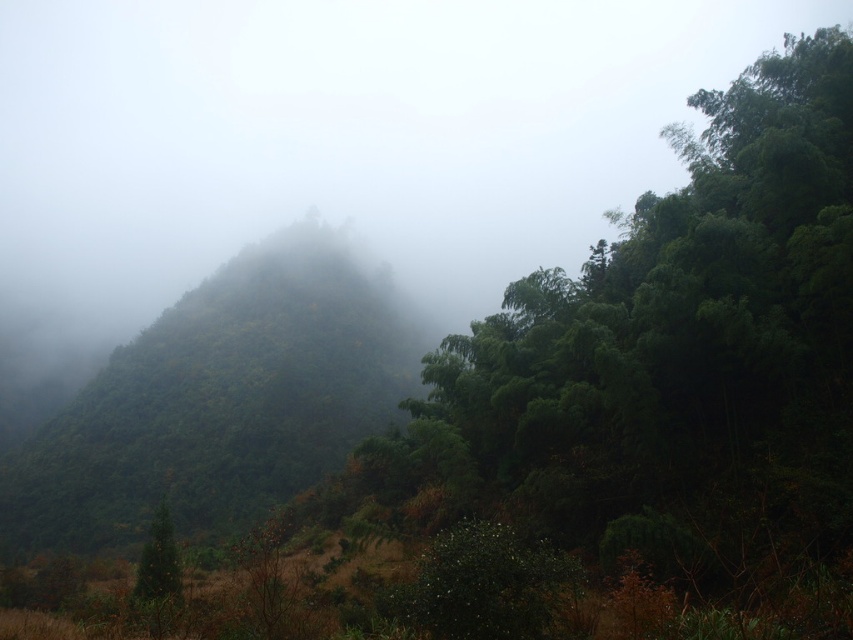
You are hiking through the misty forest and see the green matte forest at center and the green matte tree at lower left. Which one is higher up in the landscape?

The green matte forest at center is higher up than the green matte tree at lower left because it is positioned above it in the scene.

You are standing in the misty forest and see a point marked at coordinates (x=222, y=401). Based on the scene description, what does this point most likely represent?

The point at (x=222, y=401) corresponds to the green matte forest at center, which is part of the dense vegetation in the foreground of the misty forest landscape.